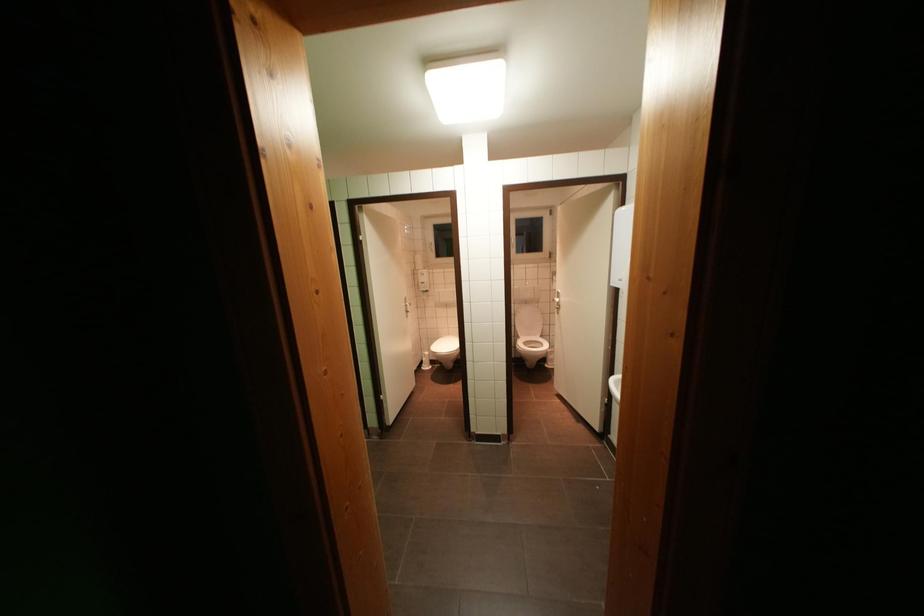
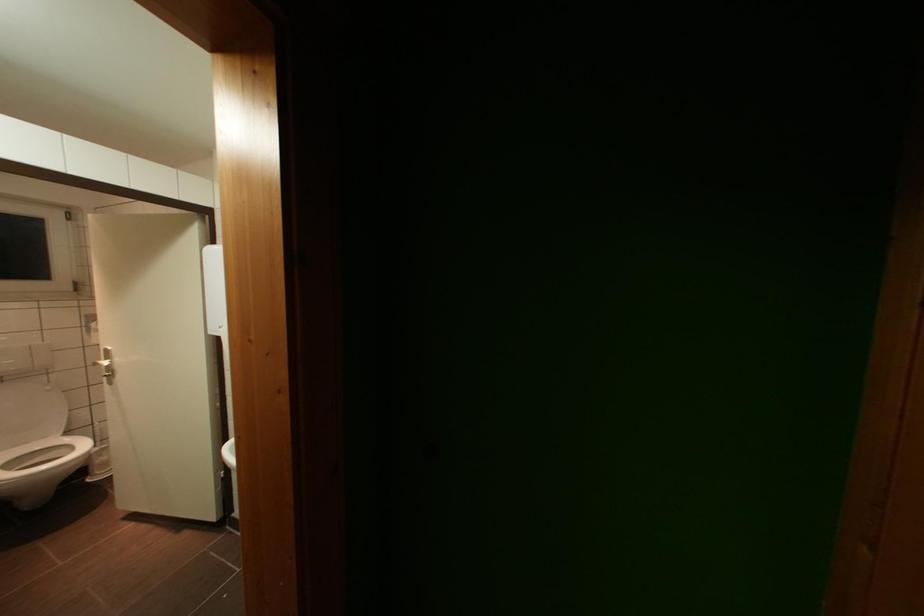
Question: The first image is from the beginning of the video and the second image is from the end. How did the camera likely rotate when shooting the video?

Choices:
 (A) Left
 (B) Right
 (C) Up
 (D) Down

Answer: (B)